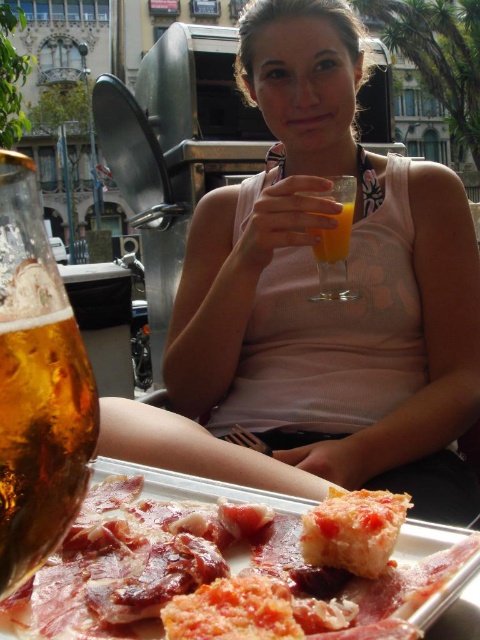
You are a delivery person who needs to place a new item at the exact location of the translucent amber liquid at lower left. What are the coordinates where you should place it?

The coordinates for the translucent amber liquid at lower left are at point (41, 438).

You are a photographer setting up for a photoshoot at this outdoor dining location. You need to ensure that the pink fabric dress at center and transparent glass at center are both visible in the frame. Given their sizes, which object should you focus on first to ensure proper framing?

The pink fabric dress at center is larger than the transparent glass at center, so you should focus on framing the pink fabric dress at center first to ensure it fits well in the composition before adjusting for the smaller transparent glass at center.

You are a food critic who needs to describe the items on the table. Which object is smaller between the translucent amber liquid at lower left and the golden crispy bread at lower center?

The translucent amber liquid at lower left is smaller than the golden crispy bread at lower center.